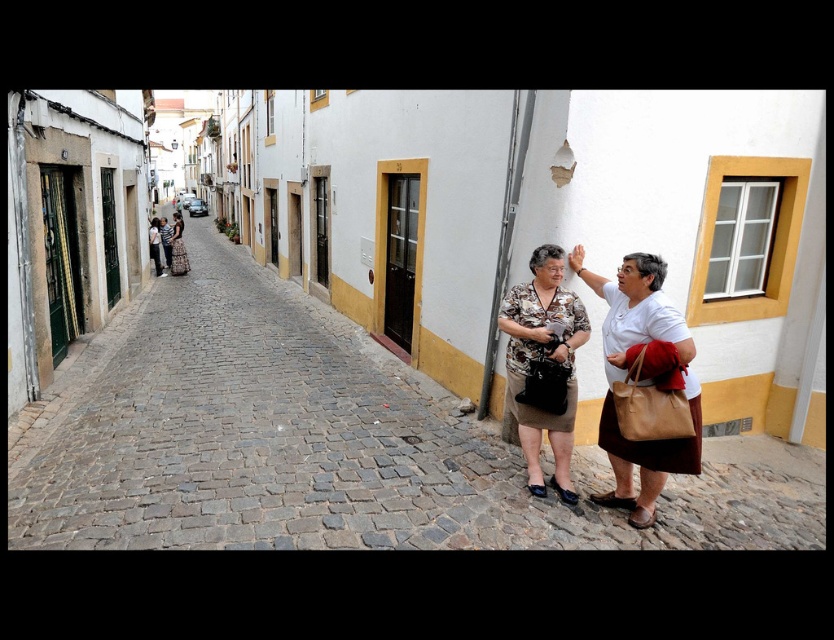
You are a photographer positioned on the cobblestone street and want to capture both the matte white shirt at center and the brown textured skirt at center in your shot. Which object should you adjust your camera to focus on first to ensure both are in frame?

You should focus on the brown textured skirt at center first because the matte white shirt at center is to the right of it, so adjusting from left to right will capture both.

You are a fashion designer observing the two women in the image. You notice the brown textured skirt at center and the matte black dress at center. Which clothing item is positioned lower on the person wearing it?

The brown textured skirt at center is below matte black dress at center, so the brown textured skirt at center is positioned lower on the person wearing it.

You are a photographer positioned at the center of the cobblestone street. You want to take a photo that includes both the matte white shirt at center and the nearest building with yellow accents. Which direction should you point your camera to ensure both are in the frame?

The matte white shirt at center is located at point (644, 385), so you should point your camera towards the center of the street to include both the matte white shirt at center and the nearest building with yellow accents in the frame.